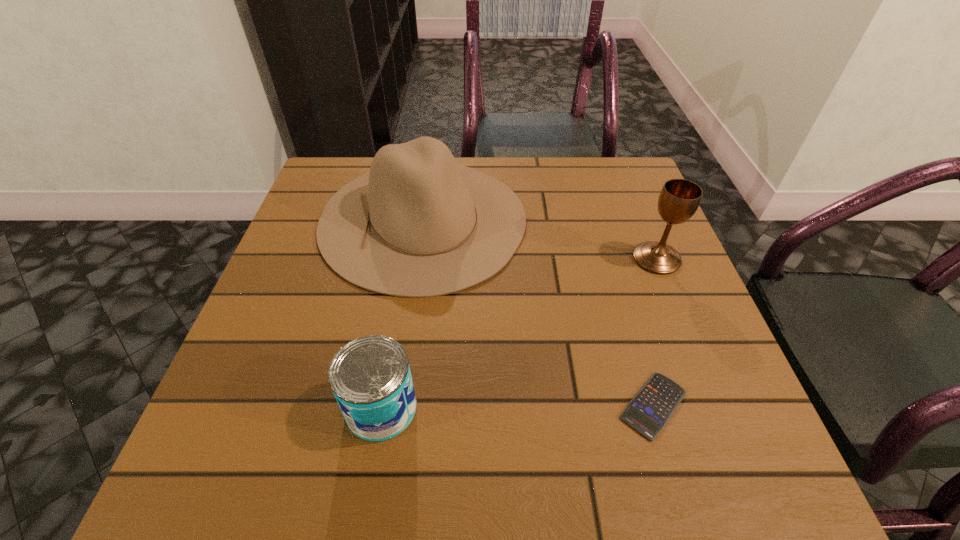
Locate which object ranks in proximity to the second shortest object. Please provide its 2D coordinates. Your answer should be formatted as a tuple, i.e. [(x, y)], where the tuple contains the x and y coordinates of a point satisfying the conditions above.

[(418, 224)]

Find the location of a particular element. The width and height of the screenshot is (960, 540). object that stands as the second closest to the sombrero is located at coordinates (651, 408).

I want to click on vacant space that satisfies the following two spatial constraints: 1. on the back side of the can; 2. on the left side of the sombrero, so click(413, 220).

The height and width of the screenshot is (540, 960). What are the coordinates of `free space that satisfies the following two spatial constraints: 1. on the back side of the chalice; 2. on the right side of the shortest object` in the screenshot? It's located at (610, 259).